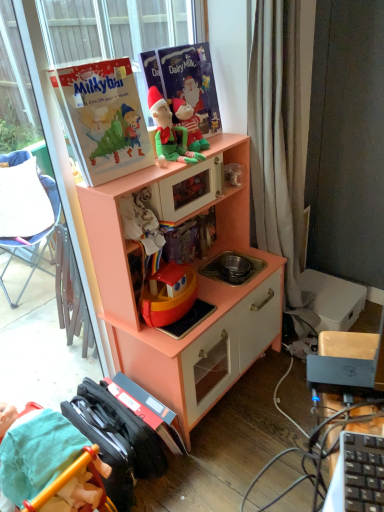
You are a GUI agent. You are given a task and a screenshot of the screen. Output one action in this format:
    pyautogui.click(x=<x>, y=<y>)
    Task: Click on the vacant area that is situated to the right of matte paperboard book at upper left, the 2th paperback book from the right
    Image resolution: width=384 pixels, height=512 pixels.
    Given the screenshot: What is the action you would take?
    pyautogui.click(x=144, y=169)